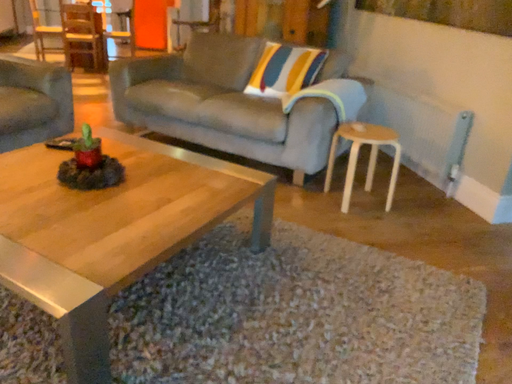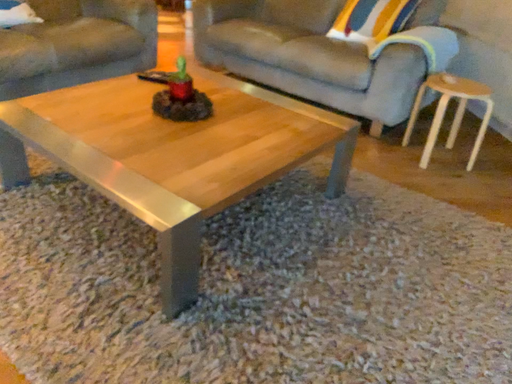
Question: Which way did the camera rotate in the video?

Choices:
 (A) rotated right
 (B) rotated left

Answer: (B)